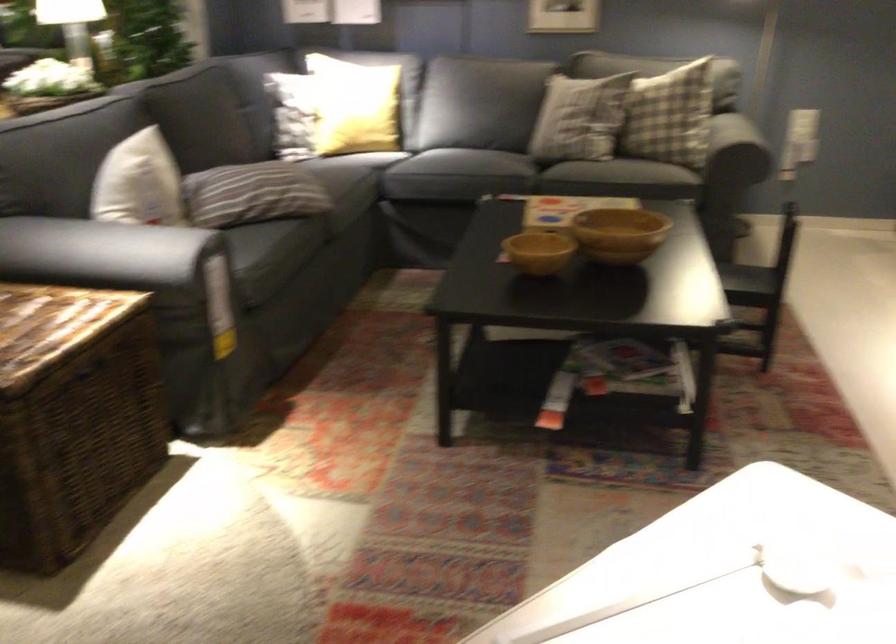
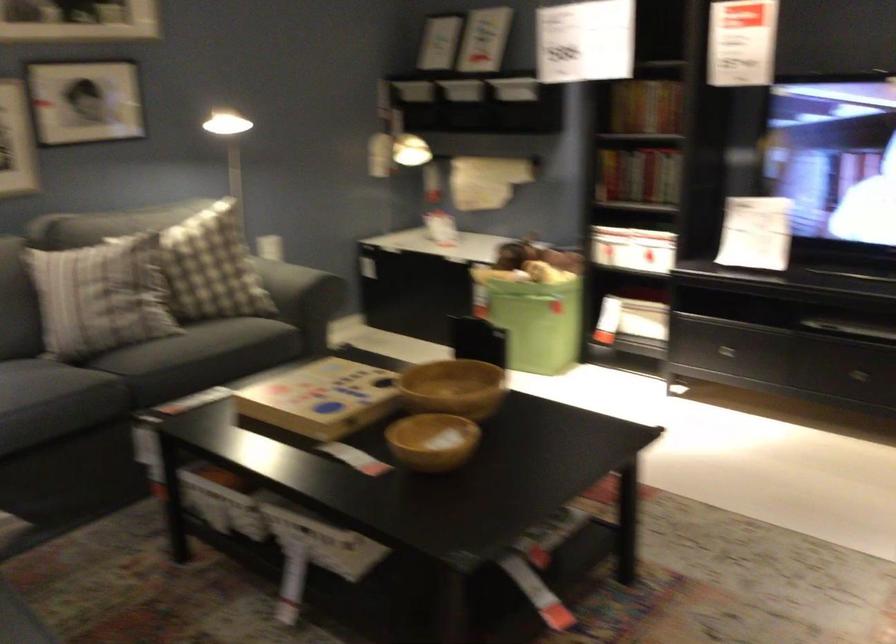
Locate, in the second image, the point that corresponds to the point at 690,131 in the first image.

(286, 285)